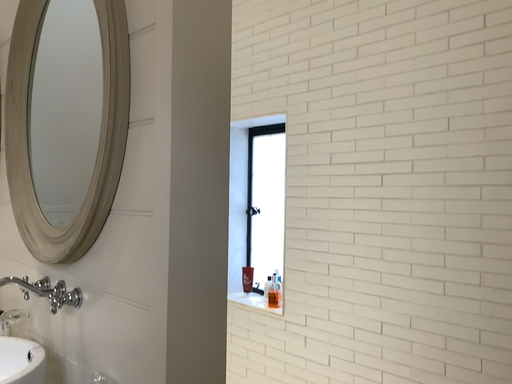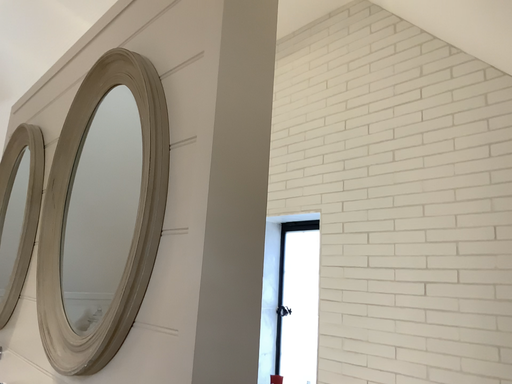
Question: Which way did the camera rotate in the video?

Choices:
 (A) rotated upward
 (B) rotated downward

Answer: (A)